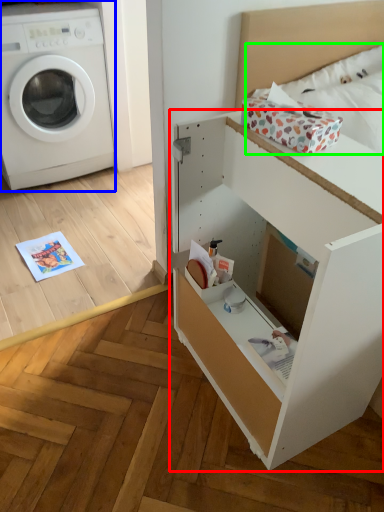
Question: Which object is positioned closest to file cabinet (highlighted by a red box)? Select from washing machine (highlighted by a blue box) and bedding (highlighted by a green box).

Choices:
 (A) washing machine
 (B) bedding

Answer: (B)